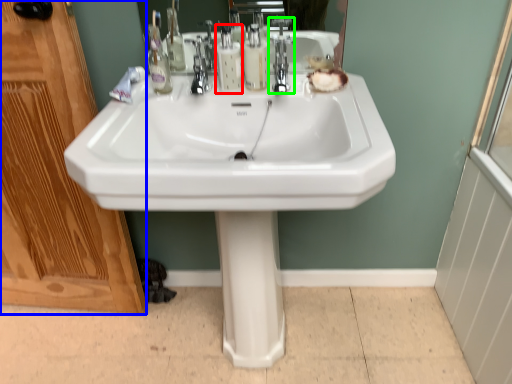
Question: Which object is positioned farthest from soap dispenser (highlighted by a red box)? Select from screen door (highlighted by a blue box) and tap (highlighted by a green box).

Choices:
 (A) screen door
 (B) tap

Answer: (A)